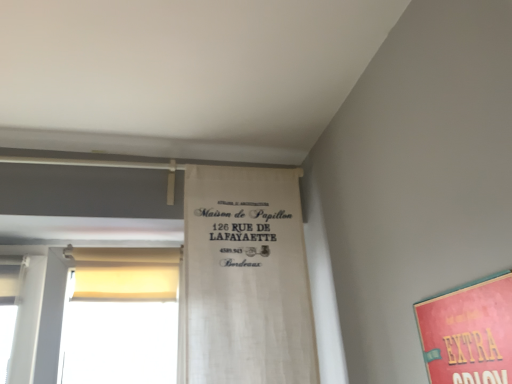
Question: Would you say white fabric banner at center is a long distance from matte pink poster at lower right?

Choices:
 (A) yes
 (B) no

Answer: (B)

Question: Considering the relative sizes of white fabric banner at center and matte pink poster at lower right in the image provided, is white fabric banner at center wider than matte pink poster at lower right?

Choices:
 (A) yes
 (B) no

Answer: (A)

Question: Are white fabric banner at center and matte pink poster at lower right beside each other?

Choices:
 (A) no
 (B) yes

Answer: (A)

Question: From a real-world perspective, does white fabric banner at center stand above matte pink poster at lower right?

Choices:
 (A) yes
 (B) no

Answer: (A)

Question: Is white fabric banner at center to the left of matte pink poster at lower right from the viewer's perspective?

Choices:
 (A) no
 (B) yes

Answer: (B)

Question: Is matte pink poster at lower right at the back of white fabric banner at center?

Choices:
 (A) no
 (B) yes

Answer: (A)

Question: Can you confirm if matte pink poster at lower right is positioned to the left of white fabric banner at center?

Choices:
 (A) yes
 (B) no

Answer: (B)

Question: Does matte pink poster at lower right appear on the right side of white fabric banner at center?

Choices:
 (A) no
 (B) yes

Answer: (B)

Question: Is the depth of matte pink poster at lower right less than that of white fabric banner at center?

Choices:
 (A) yes
 (B) no

Answer: (A)

Question: Can you confirm if matte pink poster at lower right is thinner than white fabric banner at center?

Choices:
 (A) yes
 (B) no

Answer: (A)

Question: Is matte pink poster at lower right not near white fabric banner at center?

Choices:
 (A) no
 (B) yes

Answer: (A)

Question: Is matte pink poster at lower right surrounding white fabric banner at center?

Choices:
 (A) yes
 (B) no

Answer: (B)

Question: From a real-world perspective, is white fabric banner at center above or below matte pink poster at lower right?

Choices:
 (A) above
 (B) below

Answer: (A)